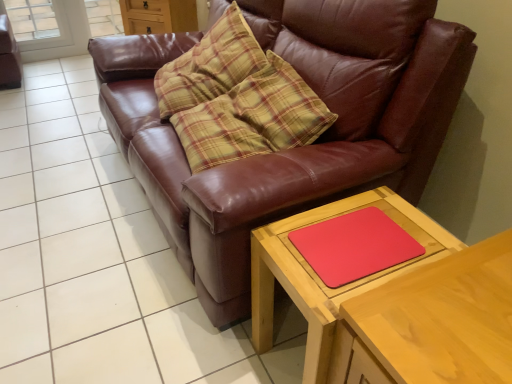
Question: Is wooden table at lower right, placed as the second table when sorted from left to right, facing towards rubberized red mouse pad at lower right?

Choices:
 (A) yes
 (B) no

Answer: (B)

Question: From a real-world perspective, is wooden table at lower right, placed as the second table when sorted from left to right, on top of rubberized red mouse pad at lower right?

Choices:
 (A) no
 (B) yes

Answer: (A)

Question: Does wooden table at lower right, which is the 1th table from right to left, have a larger size compared to rubberized red mouse pad at lower right?

Choices:
 (A) no
 (B) yes

Answer: (B)

Question: Is wooden table at lower right, which is the 1th table from right to left, wider than rubberized red mouse pad at lower right?

Choices:
 (A) yes
 (B) no

Answer: (A)

Question: Is wooden table at lower right, which is the 1th table from right to left, to the right of rubberized red mouse pad at lower right from the viewer's perspective?

Choices:
 (A) no
 (B) yes

Answer: (B)

Question: Is there a large distance between wooden table at lower right, which is the 1th table from right to left, and rubberized red mouse pad at lower right?

Choices:
 (A) no
 (B) yes

Answer: (A)

Question: Can you confirm if brown leather couch at center is positioned to the right of matte brown dresser at upper center?

Choices:
 (A) no
 (B) yes

Answer: (B)

Question: Does brown leather couch at center have a larger size compared to matte brown dresser at upper center?

Choices:
 (A) no
 (B) yes

Answer: (B)

Question: Does brown leather couch at center have a smaller size compared to matte brown dresser at upper center?

Choices:
 (A) no
 (B) yes

Answer: (A)

Question: Is brown leather couch at center wider than matte brown dresser at upper center?

Choices:
 (A) yes
 (B) no

Answer: (A)

Question: From a real-world perspective, is brown leather couch at center below matte brown dresser at upper center?

Choices:
 (A) no
 (B) yes

Answer: (A)

Question: Does brown leather couch at center come behind matte brown dresser at upper center?

Choices:
 (A) no
 (B) yes

Answer: (A)

Question: Is brown leather couch at center located outside wooden table at lower right, the first table positioned from the left?

Choices:
 (A) yes
 (B) no

Answer: (A)